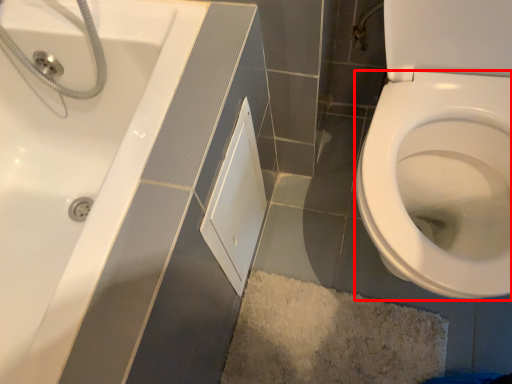
Question: Considering the relative positions of bidet (annotated by the red box) and screen door in the image provided, where is bidet (annotated by the red box) located with respect to the staircase?

Choices:
 (A) left
 (B) right

Answer: (B)